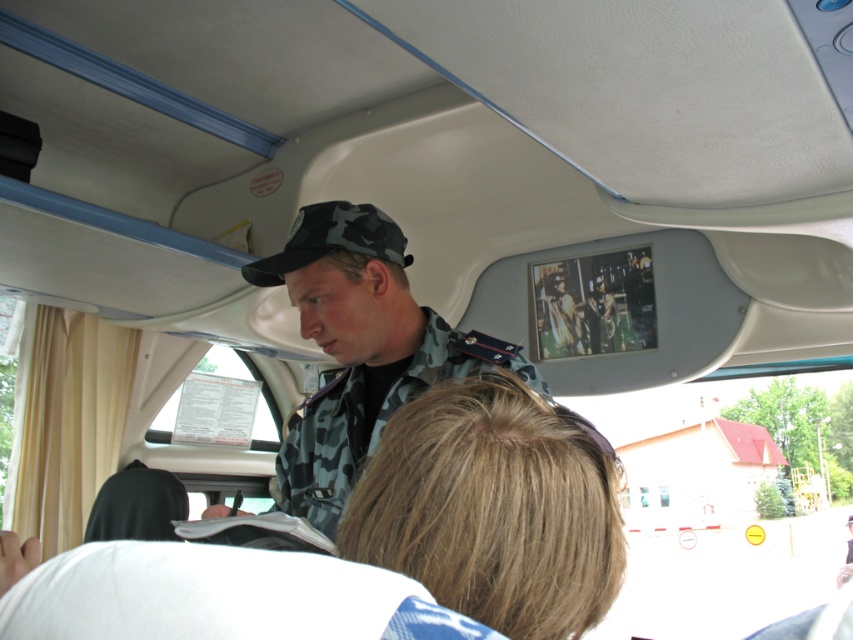
Which of these two, white fabric at lower center or camouflage uniform at center, stands taller?

camouflage uniform at center

Can you confirm if white fabric at lower center is positioned to the left of camouflage uniform at center?

→ In fact, white fabric at lower center is to the right of camouflage uniform at center.

Which is in front, point (114, 566) or point (352, 321)?

Point (114, 566) is more forward.

You are a GUI agent. You are given a task and a screenshot of the screen. Output one action in this format:
    pyautogui.click(x=<x>, y=<y>)
    Task: Click on the white fabric at lower center
    The height and width of the screenshot is (640, 853).
    Given the screenshot: What is the action you would take?
    pyautogui.click(x=219, y=596)

Can you confirm if camouflage uniform at center is taller than camouflage fabric baseball cap at upper center?

Correct, camouflage uniform at center is much taller as camouflage fabric baseball cap at upper center.

Measure the distance between camouflage uniform at center and camouflage fabric baseball cap at upper center.

They are 5.10 inches apart.

Where is `camouflage uniform at center`? The height and width of the screenshot is (640, 853). camouflage uniform at center is located at coordinates (358, 348).

Which is behind, point (306, 627) or point (241, 269)?

The point (241, 269) is more distant.

Who is more forward, (207,625) or (401,248)?

Point (207,625) is in front.

The width and height of the screenshot is (853, 640). I want to click on white fabric at lower center, so click(219, 596).